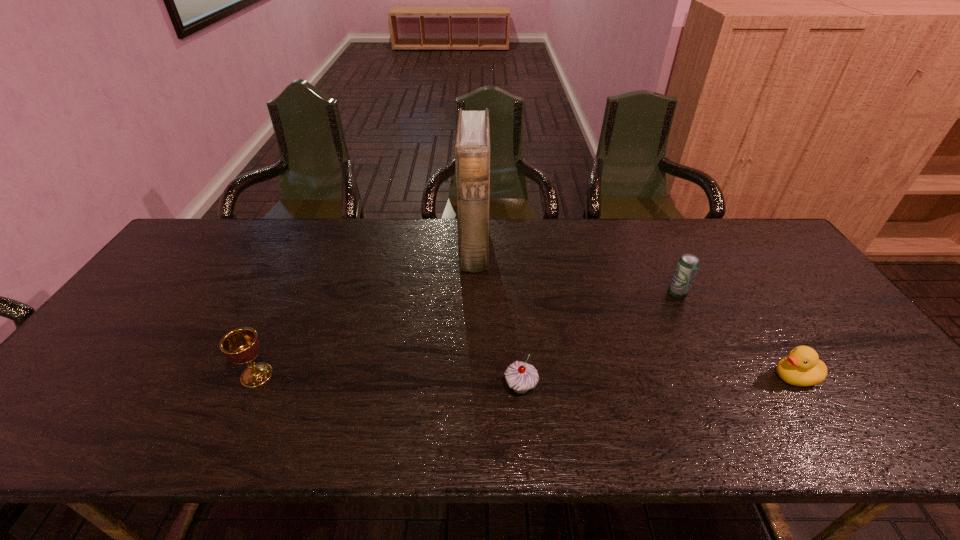
What are the coordinates of `the tallest object` in the screenshot? It's located at (472, 147).

Identify the location of phonebook. (472, 147).

Locate an element on the screen. the fourth nearest object is located at coordinates (687, 266).

Where is `beer can`? beer can is located at coordinates (687, 266).

I want to click on chalice, so tap(242, 345).

You are a GUI agent. You are given a task and a screenshot of the screen. Output one action in this format:
    pyautogui.click(x=<x>, y=<y>)
    Task: Click on the third object from left to right
    
    Given the screenshot: What is the action you would take?
    pyautogui.click(x=520, y=376)

I want to click on duckling, so click(x=802, y=367).

Where is `the shortest object`? the shortest object is located at coordinates (802, 367).

I want to click on free region located on the cover of the farthest object, so click(x=595, y=247).

You are a GUI agent. You are given a task and a screenshot of the screen. Output one action in this format:
    pyautogui.click(x=<x>, y=<y>)
    Task: Click on the vacant region located 0.050m on the left of the fourth object from left to right
    The width and height of the screenshot is (960, 540).
    Given the screenshot: What is the action you would take?
    pyautogui.click(x=650, y=295)